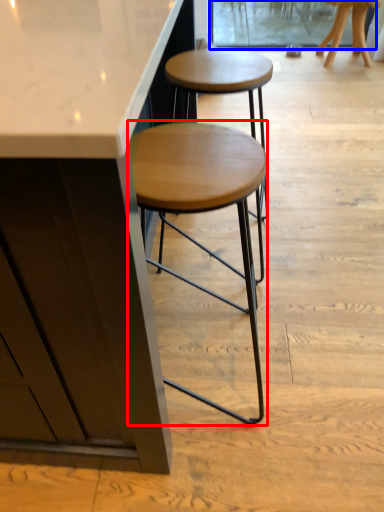
Question: Among these objects, which one is farthest to the camera, stool (highlighted by a red box) or screen door (highlighted by a blue box)?

Choices:
 (A) stool
 (B) screen door

Answer: (B)